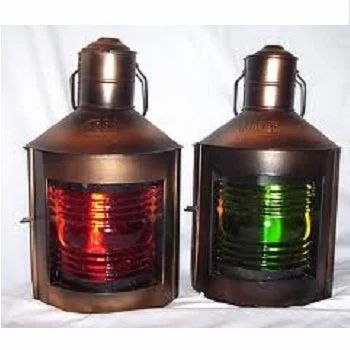
Locate an element on the screen. The image size is (350, 350). green bucket is located at coordinates 259,227.